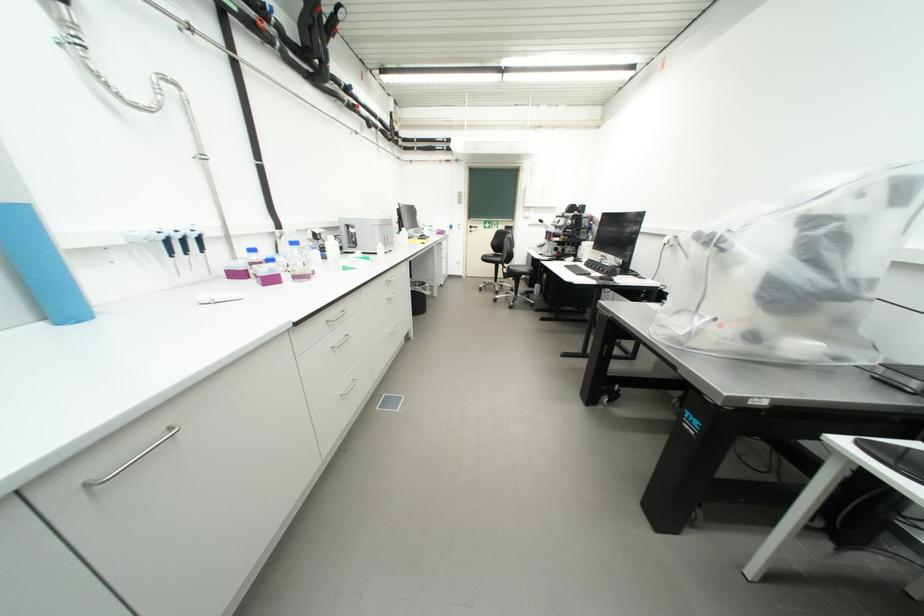
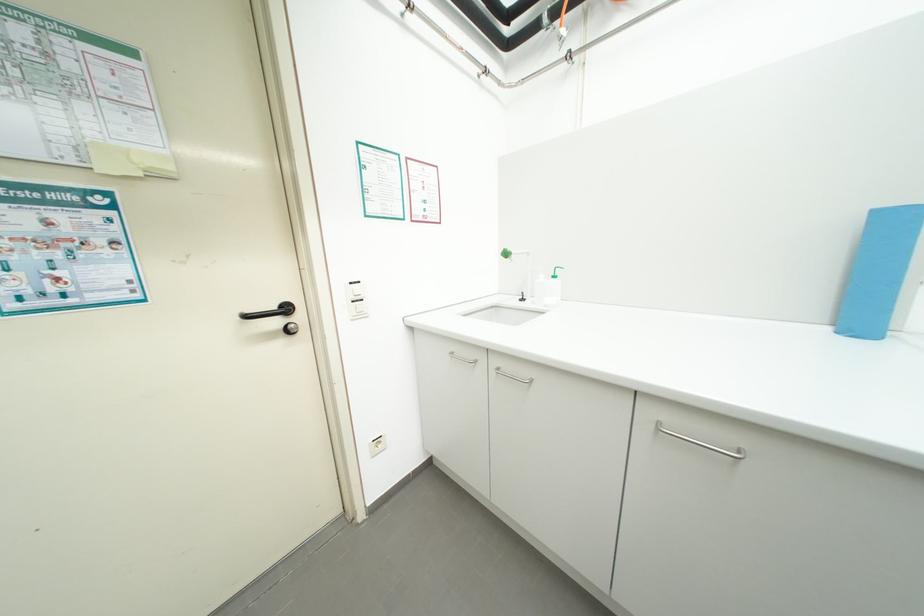
Locate, in the second image, the point that corresponds to point (51, 326) in the first image.

(835, 330)